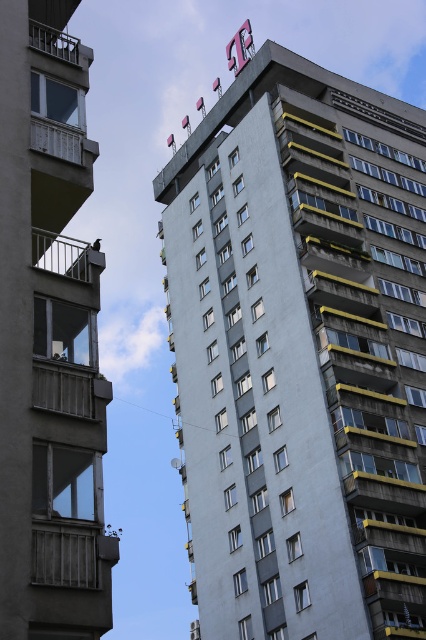
Question: Estimate the real-world distances between objects in this image. Which object is farther from the metallic railing at left?

Choices:
 (A) metallic railing at upper left
 (B) concrete balcony at left

Answer: (A)

Question: Which object is closer to the camera taking this photo?

Choices:
 (A) white painted wood balcony at left
 (B) metallic gray balcony at left
 (C) gray concrete building at center
 (D) concrete balcony at left

Answer: (D)

Question: Where is metallic gray balcony at left located in relation to white painted wood balcony at left in the image?

Choices:
 (A) above
 (B) below

Answer: (B)

Question: Is gray concrete building at center above metallic gray balcony at left?

Choices:
 (A) no
 (B) yes

Answer: (B)

Question: Estimate the real-world distances between objects in this image. Which object is farther from the white painted wood balcony at left?

Choices:
 (A) metallic railing at upper left
 (B) metallic railing at left
 (C) wooden balcony at lower left

Answer: (C)

Question: Is the position of gray concrete building at center more distant than that of concrete balcony at left?

Choices:
 (A) no
 (B) yes

Answer: (B)